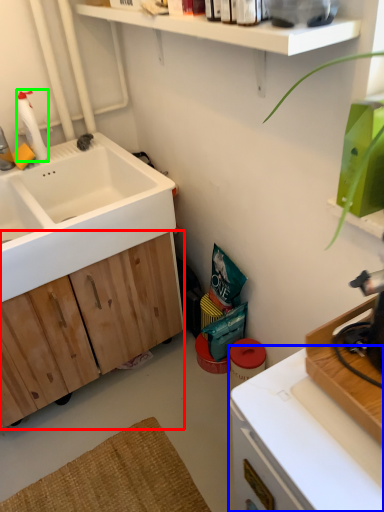
Question: Which is nearer to the cabinetry (highlighted by a red box)? countertop (highlighted by a blue box) or cleaning product (highlighted by a green box).

Choices:
 (A) countertop
 (B) cleaning product

Answer: (B)